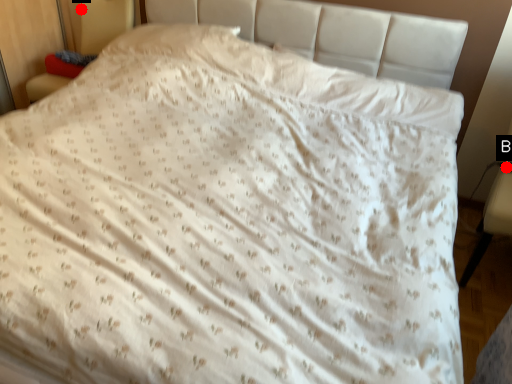
Question: Two points are circled on the image, labeled by A and B beside each circle. Which point appears farthest from the camera in this image?

Choices:
 (A) A is further
 (B) B is further

Answer: (A)